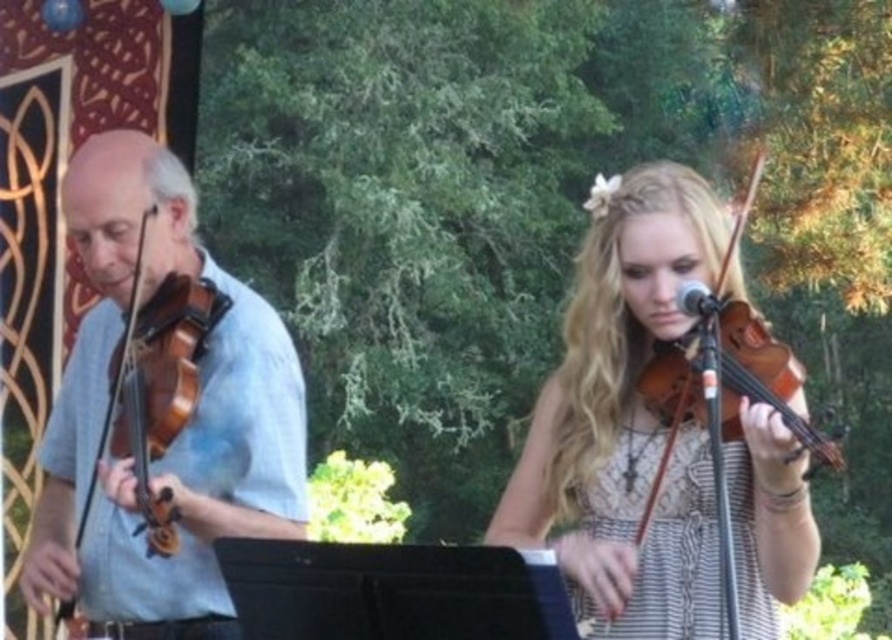
You are a photographer at the concert. You need to capture a photo where both the matte brown violin at center and the matte brown violin at left are clearly visible. Based on their positions, which violin is positioned lower in the frame?

The matte brown violin at center is positioned lower in the frame than the matte brown violin at left.

You are a music teacher observing two violinists at a park concert. You notice both are playing a matte brown violin at center and a matte brown violin at left. Which violin is smaller in size?

The matte brown violin at center is smaller than the matte brown violin at left.